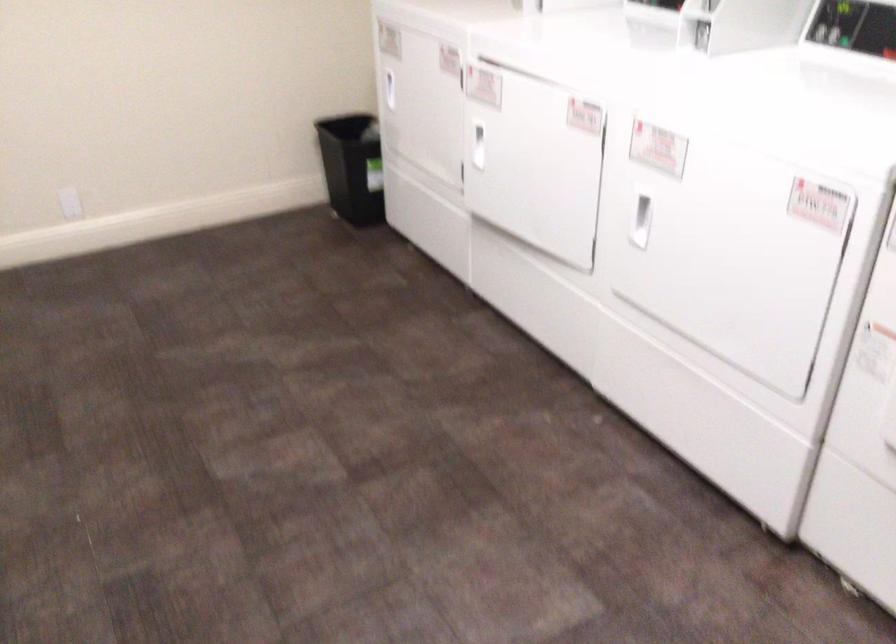
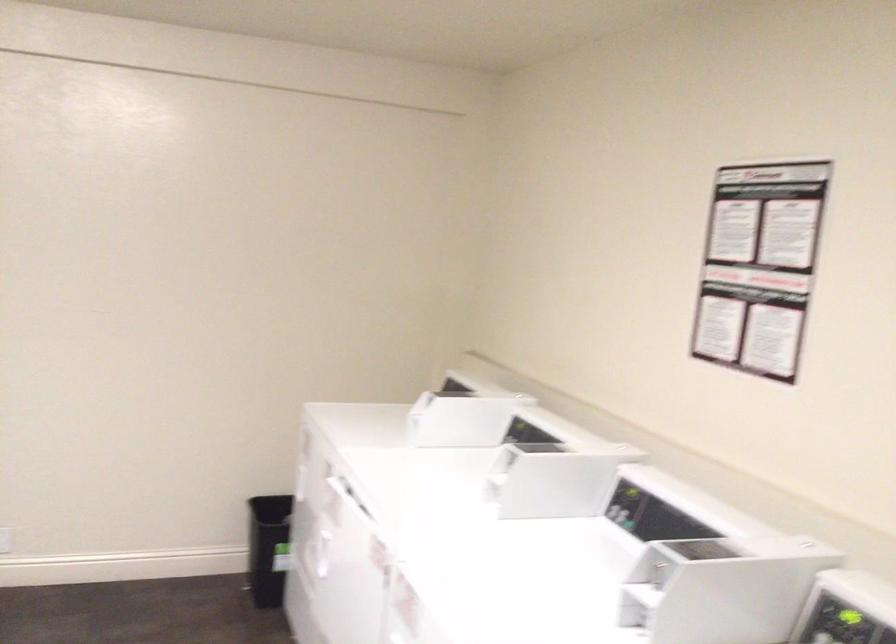
Question: How did the camera likely rotate?

Choices:
 (A) Left
 (B) Right
 (C) Up
 (D) Down

Answer: (C)